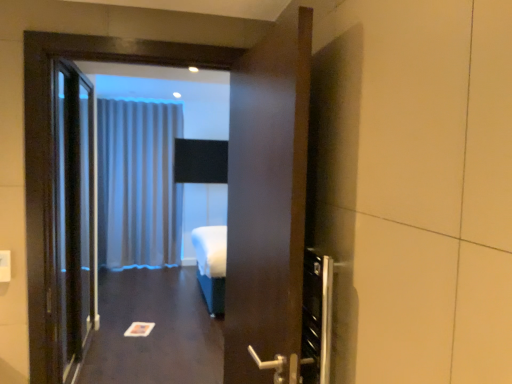
Question: From a real-world perspective, is black glass elevator door at left physically located above or below satin fabric curtain at center?

Choices:
 (A) above
 (B) below

Answer: (B)

Question: In terms of width, does black glass elevator door at left look wider or thinner when compared to satin fabric curtain at center?

Choices:
 (A) thin
 (B) wide

Answer: (A)

Question: Which object is the closest to the white glossy paper at center?

Choices:
 (A) black glass elevator door at left
 (B) satin fabric curtain at center

Answer: (A)

Question: Which object is positioned farthest from the black glass elevator door at left?

Choices:
 (A) satin fabric curtain at center
 (B) white glossy paper at center

Answer: (A)